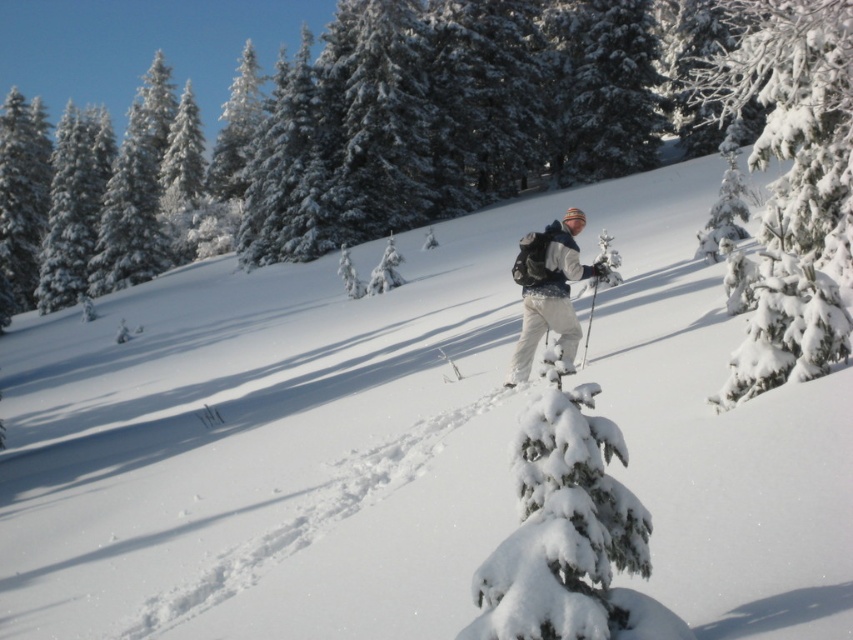
Who is more distant from viewer, (784, 314) or (515, 378)?

The point (515, 378) is behind.

Is white snow-covered tree at center positioned in front of white matte ski pants at center?

Yes.

Describe the element at coordinates (793, 186) in the screenshot. I see `white snow-covered tree at center` at that location.

This screenshot has height=640, width=853. Identify the location of white snow-covered tree at center. (793, 186).